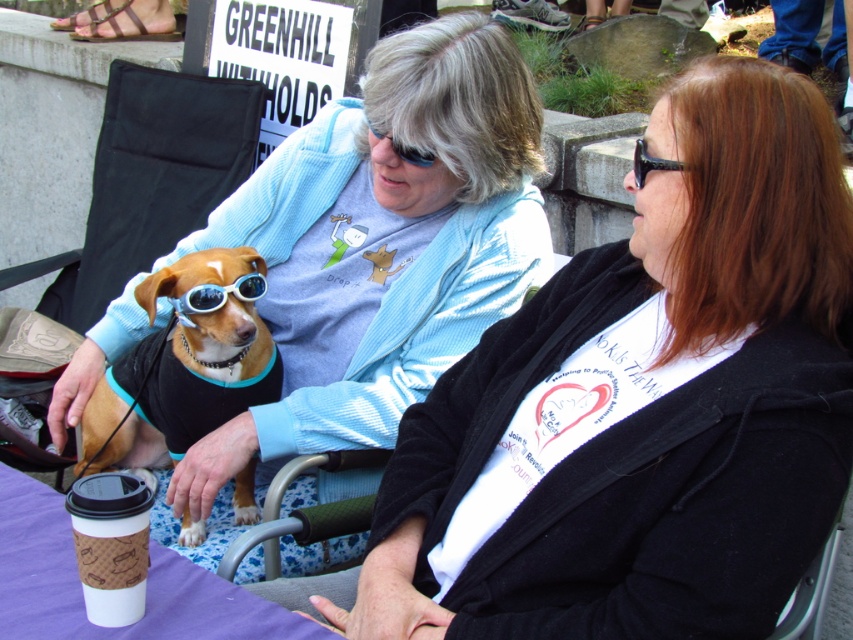
Question: Is matte blue cardigan at center to the right of sunglasses at center from the viewer's perspective?

Choices:
 (A) no
 (B) yes

Answer: (B)

Question: Does light blue corduroy sweater at center appear on the right side of blue reflective sunglasses at center?

Choices:
 (A) no
 (B) yes

Answer: (A)

Question: Can you confirm if matte blue cardigan at center is positioned below blue reflective sunglasses at center?

Choices:
 (A) no
 (B) yes

Answer: (B)

Question: Which is farther from the matte blue cardigan at center?

Choices:
 (A) light blue corduroy sweater at center
 (B) blue reflective sunglasses at center
 (C) sunglasses at center

Answer: (C)

Question: Which object appears closest to the camera in this image?

Choices:
 (A) matte blue cardigan at center
 (B) black plastic sunglasses at upper right
 (C) brownsmooth fabricdog at center-left

Answer: (A)

Question: Which object appears closest to the camera in this image?

Choices:
 (A) brownsmooth fabricdog at center-left
 (B) sunglasses at center
 (C) matte blue cardigan at center

Answer: (C)